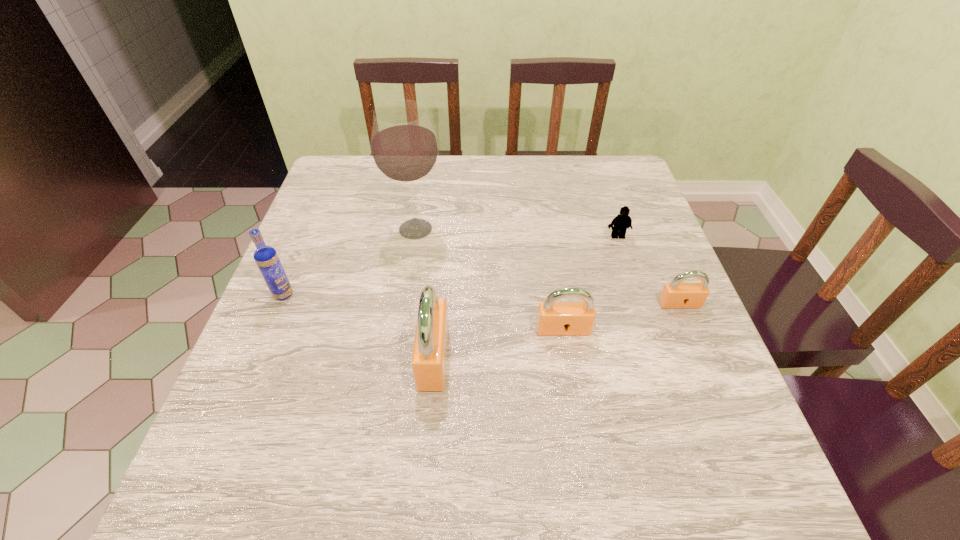
What are the coordinates of `vacant space in between the tallest object and the Lego` in the screenshot? It's located at (516, 233).

I want to click on vacant space that's between the vodka and the alcohol, so click(x=349, y=262).

The width and height of the screenshot is (960, 540). I want to click on vacant space that's between the Lego and the leftmost padlock, so click(x=526, y=297).

You are a GUI agent. You are given a task and a screenshot of the screen. Output one action in this format:
    pyautogui.click(x=<x>, y=<y>)
    Task: Click on the vacant space that's between the vodka and the fifth object from left to right
    The image size is (960, 540).
    Given the screenshot: What is the action you would take?
    pyautogui.click(x=450, y=266)

Identify which object is the second closest to the second padlock from left to right. Please provide its 2D coordinates. Your answer should be formatted as a tuple, i.e. [(x, y)], where the tuple contains the x and y coordinates of a point satisfying the conditions above.

[(429, 358)]

Identify which object is the third closest to the Lego. Please provide its 2D coordinates. Your answer should be formatted as a tuple, i.e. [(x, y)], where the tuple contains the x and y coordinates of a point satisfying the conditions above.

[(404, 148)]

Point out which padlock is positioned as the third nearest to the Lego. Please provide its 2D coordinates. Your answer should be formatted as a tuple, i.e. [(x, y)], where the tuple contains the x and y coordinates of a point satisfying the conditions above.

[(429, 358)]

Select which padlock is the third closest to the second object from right to left. Please provide its 2D coordinates. Your answer should be formatted as a tuple, i.e. [(x, y)], where the tuple contains the x and y coordinates of a point satisfying the conditions above.

[(429, 358)]

You are a GUI agent. You are given a task and a screenshot of the screen. Output one action in this format:
    pyautogui.click(x=<x>, y=<y>)
    Task: Click on the vacant position in the image that satisfies the following two spatial constraints: 1. on the face of the fifth object from left to right; 2. to unlock the leftmost padlock from the front
    
    Given the screenshot: What is the action you would take?
    point(658,357)

Find the location of a particular element. vacant space that satisfies the following two spatial constraints: 1. to unlock the rightmost padlock from the front; 2. to unlock the tallest padlock from the front is located at coordinates (702, 357).